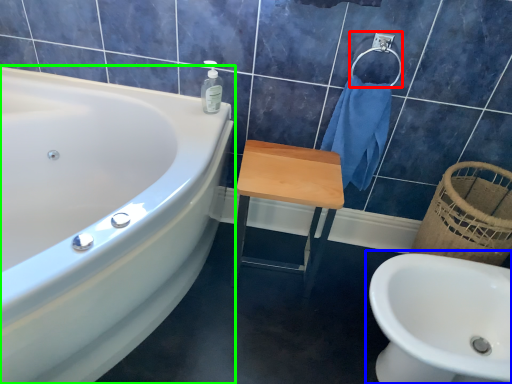
Question: Based on their relative distances, which object is nearer to towel bar (highlighted by a red box)? Choose from sink (highlighted by a blue box) and bathtub (highlighted by a green box).

Choices:
 (A) sink
 (B) bathtub

Answer: (A)